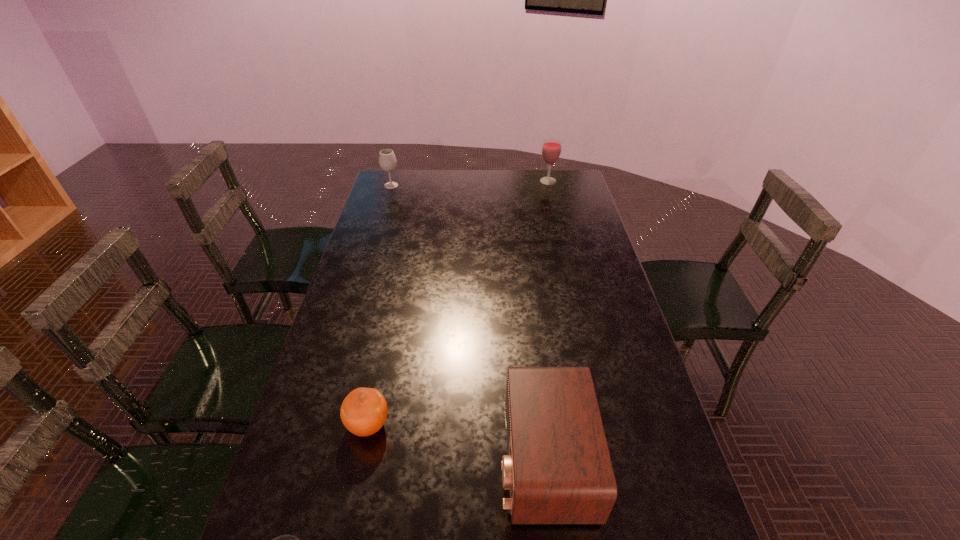
The width and height of the screenshot is (960, 540). I want to click on the rightmost wineglass, so click(551, 148).

At what (x,y) coordinates should I click in order to perform the action: click on radio receiver. Please return your answer as a coordinate pair (x, y). Image resolution: width=960 pixels, height=540 pixels. Looking at the image, I should click on (558, 470).

Image resolution: width=960 pixels, height=540 pixels. Identify the location of orange. (363, 412).

Where is `vacant space situated 0.210m on the left of the rightmost object`? This screenshot has height=540, width=960. vacant space situated 0.210m on the left of the rightmost object is located at coordinates pyautogui.click(x=492, y=181).

Identify the location of free space located 0.360m on the front panel of the radio receiver. (344, 460).

Find the location of a particular element. free point located on the front panel of the radio receiver is located at coordinates (373, 460).

Locate an element on the screen. This screenshot has height=540, width=960. vacant space located on the front panel of the radio receiver is located at coordinates (452, 460).

You are a GUI agent. You are given a task and a screenshot of the screen. Output one action in this format:
    pyautogui.click(x=<x>, y=<y>)
    Task: Click on the vacant space located on the back of the shortest object
    
    Given the screenshot: What is the action you would take?
    pyautogui.click(x=393, y=310)

What are the coordinates of `wineglass at the left edge` in the screenshot? It's located at (387, 160).

Where is `orange at the left edge`? orange at the left edge is located at coordinates (363, 412).